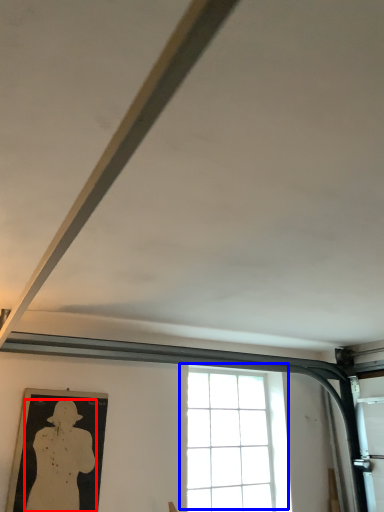
Question: Which point is further to the camera, person (highlighted by a red box) or window (highlighted by a blue box)?

Choices:
 (A) person
 (B) window

Answer: (B)